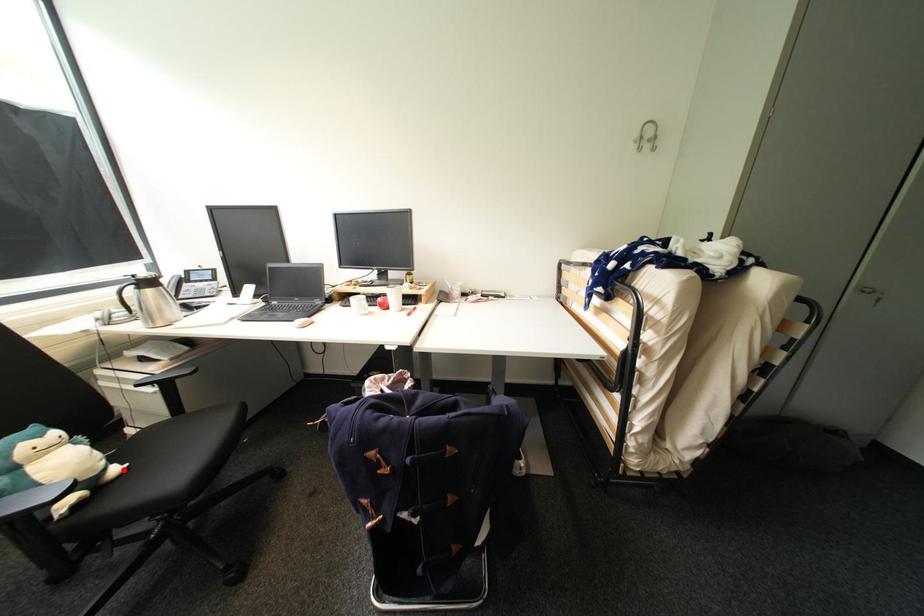
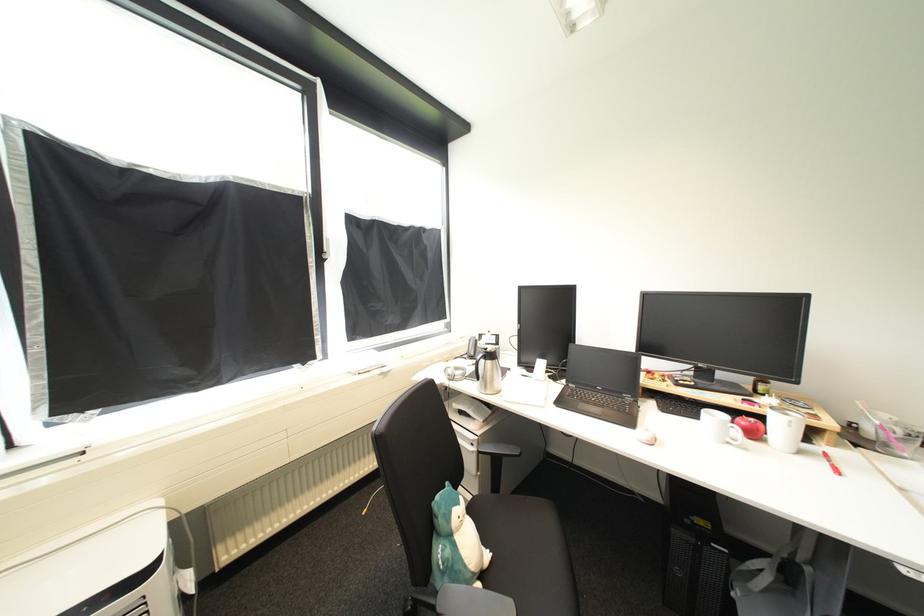
Where in the second image is the point corresponding to the highlighted location from the first image?

(493, 557)